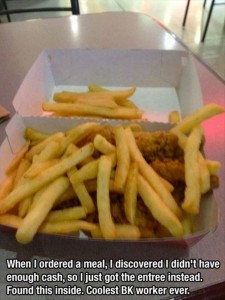
You are a GUI agent. You are given a task and a screenshot of the screen. Output one action in this format:
    pyautogui.click(x=<x>, y=<y>)
    Task: Click on the floor
    The height and width of the screenshot is (300, 225).
    Given the screenshot: What is the action you would take?
    pyautogui.click(x=167, y=14)